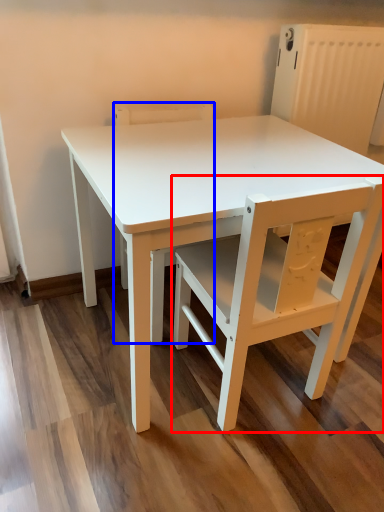
Question: Among these objects, which one is farthest to the camera, chair (highlighted by a red box) or chair (highlighted by a blue box)?

Choices:
 (A) chair
 (B) chair

Answer: (B)